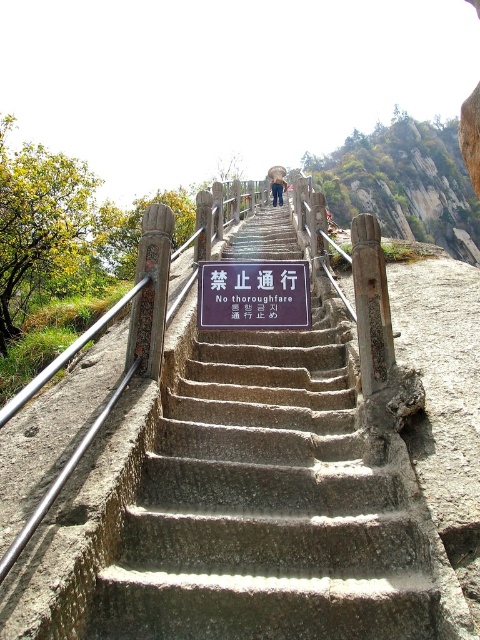
Question: Which object is positioned farthest from the metallic rectangular sign at center?

Choices:
 (A) gray concrete stairs at center
 (B) blue denim jeans at center
 (C) black plastic sign at center

Answer: (B)

Question: Which of the following is the farthest from the observer?

Choices:
 (A) metallic rectangular sign at center
 (B) gray concrete stairs at center

Answer: (A)

Question: Is gray concrete stairs at center to the left of blue denim jeans at center from the viewer's perspective?

Choices:
 (A) yes
 (B) no

Answer: (A)

Question: Is gray concrete stairs at center below blue denim jeans at center?

Choices:
 (A) no
 (B) yes

Answer: (B)

Question: Can you confirm if black plastic sign at center is positioned to the left of blue denim jeans at center?

Choices:
 (A) yes
 (B) no

Answer: (A)

Question: Which point appears closest to the camera in this image?

Choices:
 (A) (276, 186)
 (B) (312, 572)

Answer: (B)